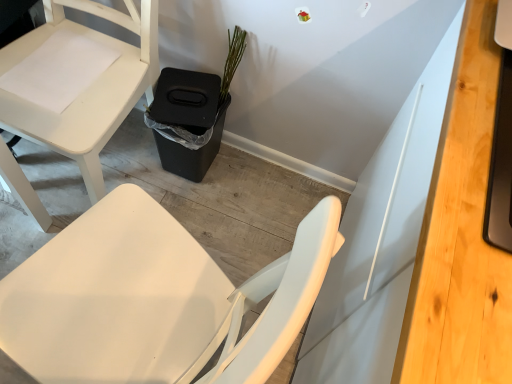
You are a GUI agent. You are given a task and a screenshot of the screen. Output one action in this format:
    pyautogui.click(x=<x>, y=<y>)
    Task: Click on the green matte plant at upper center
    Image resolution: width=512 pixels, height=384 pixels.
    Given the screenshot: What is the action you would take?
    pyautogui.click(x=232, y=60)

Where is `black plastic trash bin at lower center`? This screenshot has width=512, height=384. black plastic trash bin at lower center is located at coordinates (188, 120).

Between light wood desk at right and green matte plant at upper center, which one is positioned behind?

green matte plant at upper center is behind.

What's the angular difference between light wood desk at right and green matte plant at upper center's facing directions?

The angle between the facing direction of light wood desk at right and the facing direction of green matte plant at upper center is 89.9 degrees.

Looking at this image, between light wood desk at right and green matte plant at upper center, which one appears on the right side from the viewer's perspective?

light wood desk at right.

From a real-world perspective, between light wood desk at right and green matte plant at upper center, who is vertically lower?

In real-world perspective, green matte plant at upper center is lower.

From the image's perspective, between green matte plant at upper center and light wood desk at right, who is located below?

light wood desk at right.

From a real-world perspective, between green matte plant at upper center and light wood desk at right, who is vertically lower?

From a 3D spatial view, green matte plant at upper center is below.

Based on the photo, would you say green matte plant at upper center is a long distance from light wood desk at right?

Actually, green matte plant at upper center and light wood desk at right are a little close together.

Is green matte plant at upper center facing away from light wood desk at right?

No, green matte plant at upper center is not facing away from light wood desk at right.

In the scene shown: Considering the relative sizes of black plastic trash bin at lower center and light wood desk at right in the image provided, is black plastic trash bin at lower center smaller than light wood desk at right?

Incorrect, black plastic trash bin at lower center is not smaller in size than light wood desk at right.

Which is behind, black plastic trash bin at lower center or light wood desk at right?

Positioned behind is black plastic trash bin at lower center.

Is point (183, 144) more distant than point (500, 317)?

Yes.

Can you confirm if black plastic trash bin at lower center is taller than light wood desk at right?

Yes.

Is green matte plant at upper center bigger or smaller than white matte chair at lower left?

Clearly, green matte plant at upper center is smaller in size than white matte chair at lower left.

Who is shorter, green matte plant at upper center or white matte chair at lower left?

With less height is green matte plant at upper center.

From the image's perspective, does green matte plant at upper center appear lower than white matte chair at lower left?

Actually, green matte plant at upper center appears above white matte chair at lower left in the image.

Can you tell me how much green matte plant at upper center and white matte chair at lower left differ in facing direction?

There is a 0.00024-degree angle between the facing directions of green matte plant at upper center and white matte chair at lower left.

From the image's perspective, would you say white matte chair at lower left is shown under black plastic trash bin at lower center?

No, from the image's perspective, white matte chair at lower left is not below black plastic trash bin at lower center.

Does white matte chair at lower left have a greater height compared to black plastic trash bin at lower center?

Yes, white matte chair at lower left is taller than black plastic trash bin at lower center.

Is point (63, 138) positioned behind point (214, 120)?

No, it is not.

From a real-world perspective, which is physically below, white matte chair at lower left or black plastic trash bin at lower center?

black plastic trash bin at lower center is physically lower.

Can you tell me how much black plastic trash bin at lower center and green matte plant at upper center differ in facing direction?

black plastic trash bin at lower center and green matte plant at upper center are facing 0.00045 degrees away from each other.

Considering the positions of points (164, 102) and (233, 59), is point (164, 102) closer to camera compared to point (233, 59)?

No, it is behind (233, 59).

Image resolution: width=512 pixels, height=384 pixels. I want to click on trash bin/can behind the green matte plant at upper center, so click(188, 120).

Which point is more forward, (199,140) or (15,112)?

The point (15,112) is more forward.

From the image's perspective, is black plastic trash bin at lower center located beneath white matte chair at lower left?

Yes, from the image's perspective, black plastic trash bin at lower center is beneath white matte chair at lower left.

Considering the relative sizes of black plastic trash bin at lower center and white matte chair at lower left in the image provided, is black plastic trash bin at lower center smaller than white matte chair at lower left?

Correct, black plastic trash bin at lower center occupies less space than white matte chair at lower left.

Does black plastic trash bin at lower center come in front of white matte chair at lower left?

That is False.

Where is `desk above the green matte plant at upper center (from a real-world perspective)`? This screenshot has height=384, width=512. desk above the green matte plant at upper center (from a real-world perspective) is located at coordinates (461, 234).

This screenshot has width=512, height=384. I want to click on plant that appears below the light wood desk at right (from a real-world perspective), so click(x=232, y=60).

Looking at the image, which one is located further to light wood desk at right, white matte chair at lower left or green matte plant at upper center?

Among the two, white matte chair at lower left is located further to light wood desk at right.

Considering their positions, is black plastic trash bin at lower center positioned closer to light wood desk at right than green matte plant at upper center?

green matte plant at upper center is positioned closer to the anchor light wood desk at right.

Looking at the image, which one is located further to white matte chair at lower left, green matte plant at upper center or black plastic trash bin at lower center?

Among the two, green matte plant at upper center is located further to white matte chair at lower left.

Looking at the image, which one is located further to black plastic trash bin at lower center, white matte chair at lower left or green matte plant at upper center?

white matte chair at lower left lies further to black plastic trash bin at lower center than the other object.

Which object lies nearer to the anchor point light wood desk at right, green matte plant at upper center or black plastic trash bin at lower center?

green matte plant at upper center is closer to light wood desk at right.

Looking at this image, which object lies nearer to the anchor point white matte chair at lower left, light wood desk at right or black plastic trash bin at lower center?

The object closer to white matte chair at lower left is black plastic trash bin at lower center.

Based on their spatial positions, is white matte chair at lower left or light wood desk at right further from green matte plant at upper center?

light wood desk at right lies further to green matte plant at upper center than the other object.

Based on their spatial positions, is light wood desk at right or green matte plant at upper center further from black plastic trash bin at lower center?

light wood desk at right is positioned further to the anchor black plastic trash bin at lower center.

The width and height of the screenshot is (512, 384). In order to click on trash bin/can between white matte chair at lower left and light wood desk at right in the horizontal direction in this screenshot , I will do `click(188, 120)`.

Identify the location of plant located between white matte chair at lower left and light wood desk at right in the left-right direction. The image size is (512, 384). (232, 60).

This screenshot has width=512, height=384. I want to click on plant between white matte chair at lower left and black plastic trash bin at lower center from front to back, so click(x=232, y=60).

You are a GUI agent. You are given a task and a screenshot of the screen. Output one action in this format:
    pyautogui.click(x=<x>, y=<y>)
    Task: Click on the plant between light wood desk at right and black plastic trash bin at lower center along the z-axis
    The height and width of the screenshot is (384, 512).
    Given the screenshot: What is the action you would take?
    pyautogui.click(x=232, y=60)